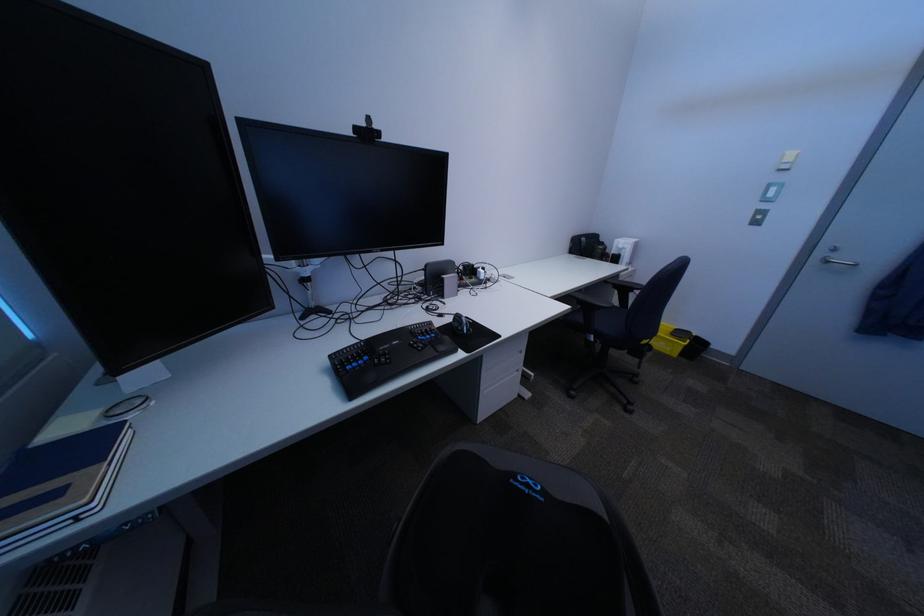
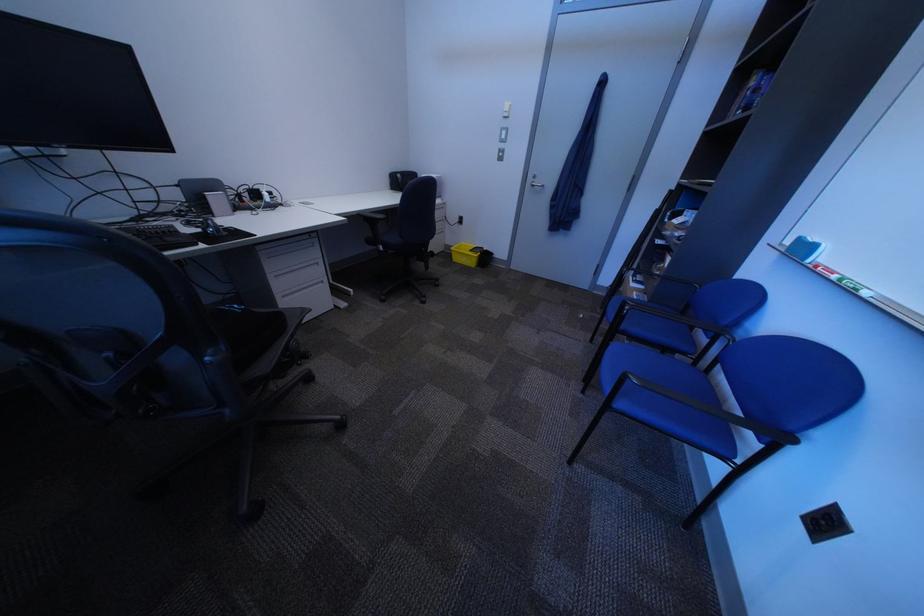
Locate, in the second image, the point that corresponds to the point at 394,252 in the first image.

(80, 148)